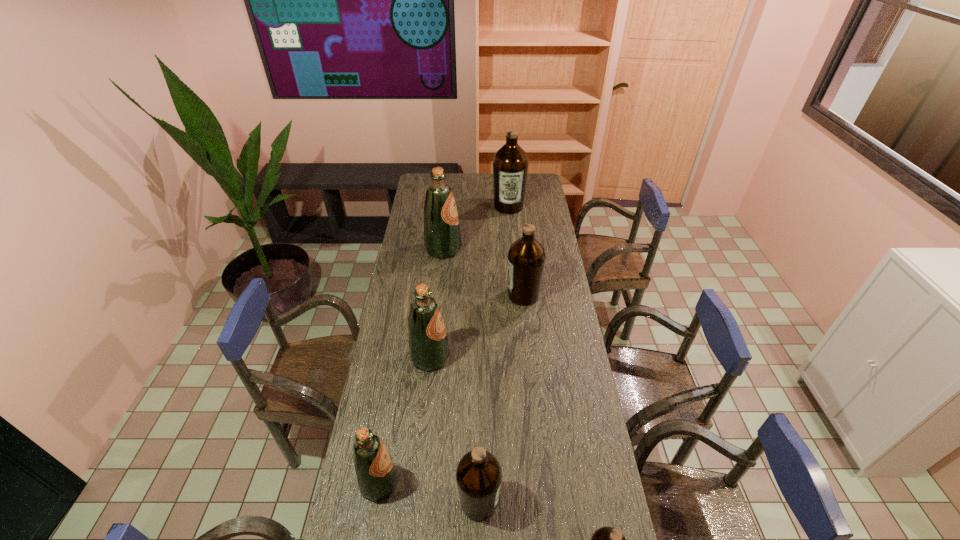
Where is `vacant space at the right edge`? vacant space at the right edge is located at coordinates (583, 477).

The image size is (960, 540). In the image, there is a desktop. In order to click on vacant space at the far left corner in this screenshot , I will do `click(417, 180)`.

I want to click on vacant space at the far right corner of the desktop, so click(x=530, y=184).

At what (x,y) coordinates should I click in order to perform the action: click on free space between the fourth olive oil from left to right and the fourth nearest object. Please return your answer as a coordinate pair (x, y). Looking at the image, I should click on (454, 430).

Identify the location of free space between the second smallest green olive oil and the smallest green olive oil. (404, 420).

Locate an element on the screen. free space between the fourth object from right to left and the nearest green olive oil is located at coordinates (429, 492).

Where is `blank region between the leftmost brown olive oil and the second farthest brown olive oil`? The height and width of the screenshot is (540, 960). blank region between the leftmost brown olive oil and the second farthest brown olive oil is located at coordinates (501, 399).

Identify the location of vacant region between the smallest green olive oil and the fourth object from left to right. The width and height of the screenshot is (960, 540). (429, 492).

Find the location of a particular element. Image resolution: width=960 pixels, height=540 pixels. free point between the fourth object from left to right and the smallest green olive oil is located at coordinates (429, 492).

Find the location of a particular element. object that is the fourth nearest to the third farthest object is located at coordinates (478, 475).